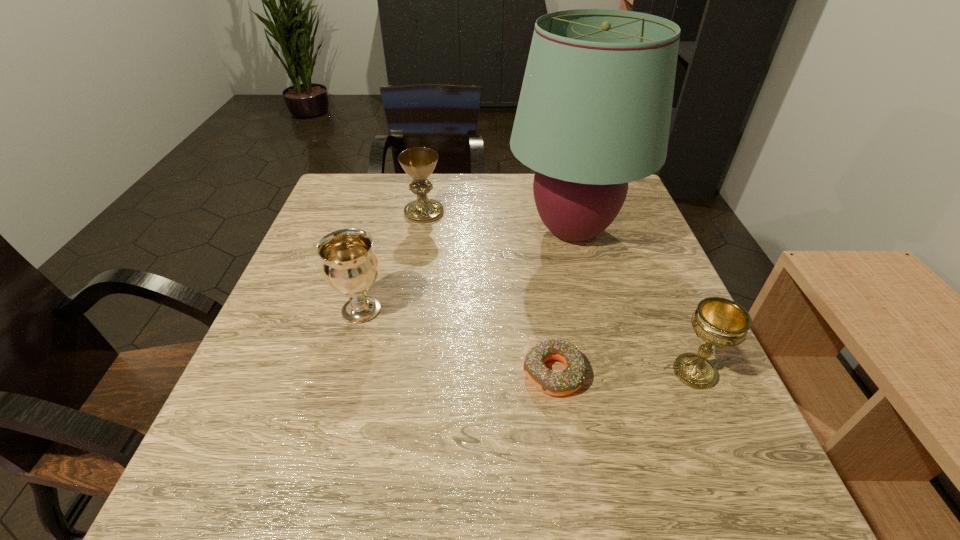
The width and height of the screenshot is (960, 540). What are the coordinates of `the tallest object` in the screenshot? It's located at (594, 112).

Where is `the third farthest object`? the third farthest object is located at coordinates (350, 267).

What are the coordinates of `the farthest chalice` in the screenshot? It's located at (419, 162).

Where is `the nearest chalice`? the nearest chalice is located at coordinates (720, 322).

You are a GUI agent. You are given a task and a screenshot of the screen. Output one action in this format:
    pyautogui.click(x=<x>, y=<y>)
    Task: Click on the shortest object
    The height and width of the screenshot is (540, 960).
    Given the screenshot: What is the action you would take?
    pyautogui.click(x=562, y=383)

Image resolution: width=960 pixels, height=540 pixels. I want to click on free region located on the back of the tallest object, so click(x=558, y=176).

Locate an element on the screen. vacant area situated 0.190m on the back of the third farthest object is located at coordinates (381, 239).

The height and width of the screenshot is (540, 960). Find the location of `blank area located on the right of the farthest chalice`. blank area located on the right of the farthest chalice is located at coordinates pos(556,212).

Identify the location of free space located on the left of the nearest chalice. This screenshot has height=540, width=960. (564, 372).

This screenshot has height=540, width=960. I want to click on vacant space located on the back of the doughnut, so coord(534,245).